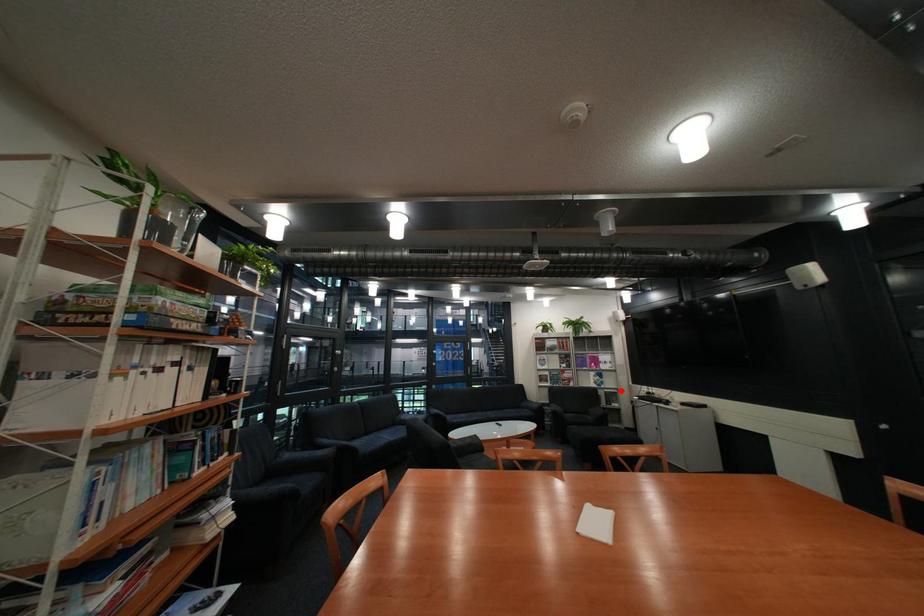
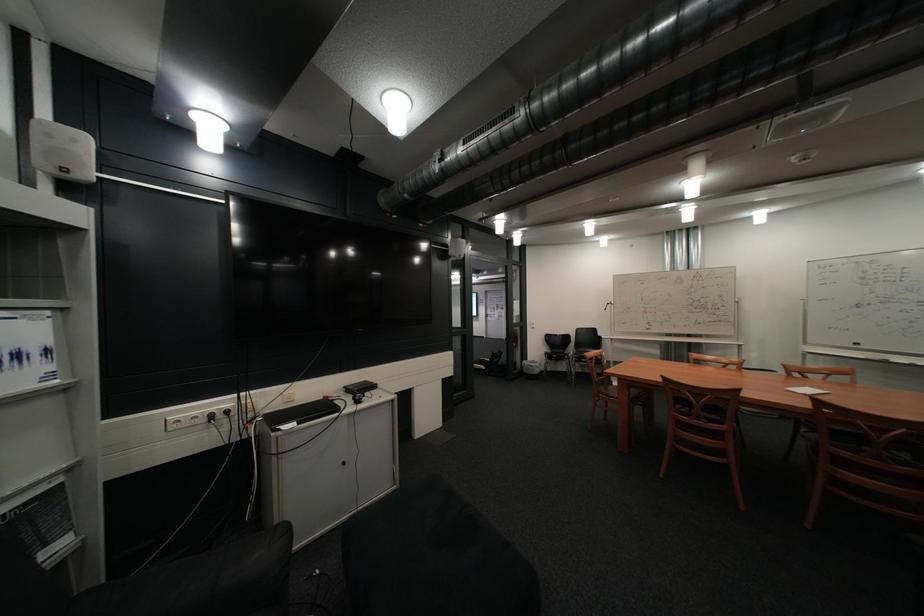
In the second image, find the point that corresponds to the highlighted location in the first image.

(10, 514)